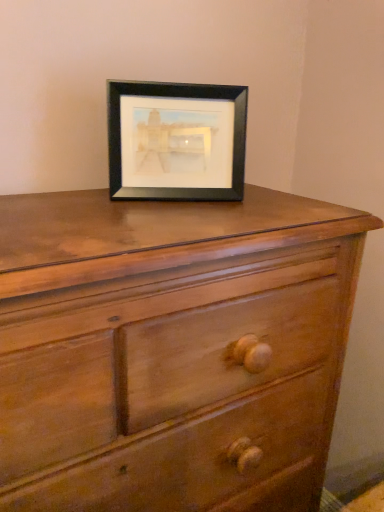
Find the location of a particular element. This screenshot has height=512, width=384. free point above matte wood chest of drawers at center (from a real-world perspective) is located at coordinates (168, 212).